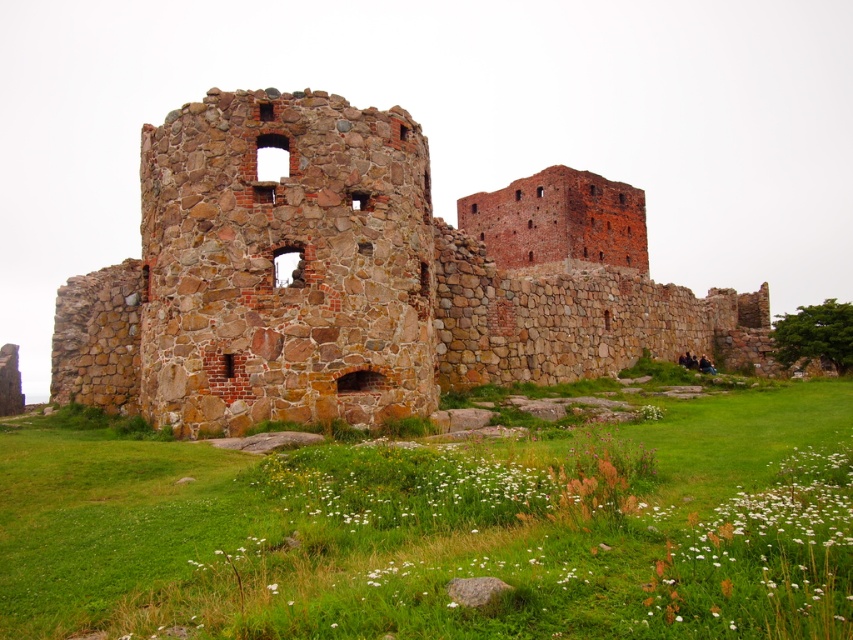
Question: Which of the following is the farthest from the observer?

Choices:
 (A) brown stone castle at center
 (B) green grassy at center

Answer: (A)

Question: Among these objects, which one is farthest from the camera?

Choices:
 (A) brown stone castle at center
 (B) green grassy at center

Answer: (A)

Question: Is green grassy at center above brown stone castle at center?

Choices:
 (A) no
 (B) yes

Answer: (A)

Question: Can you confirm if green grassy at center is positioned to the left of brown stone castle at center?

Choices:
 (A) no
 (B) yes

Answer: (B)

Question: Is green grassy at center smaller than brown stone castle at center?

Choices:
 (A) yes
 (B) no

Answer: (A)